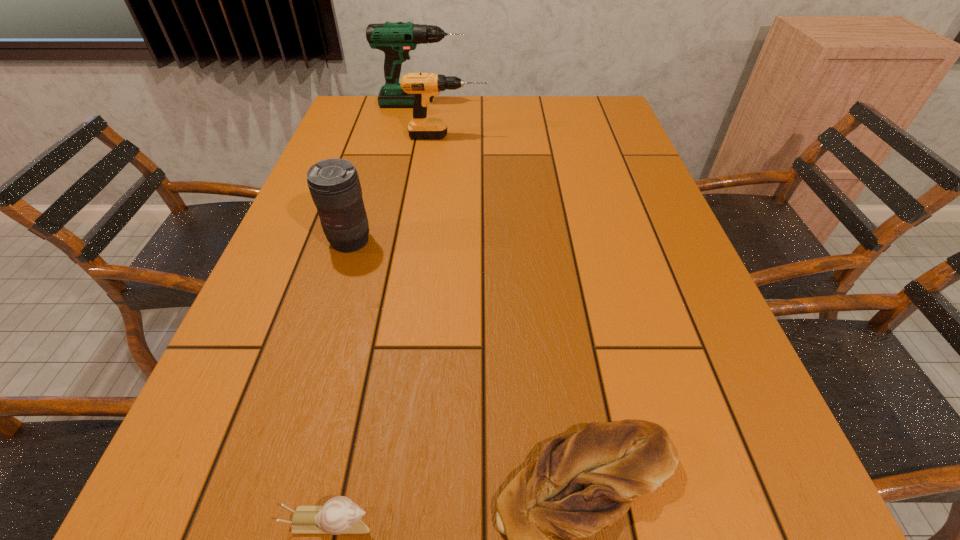
Find the location of a particular element. The width and height of the screenshot is (960, 540). telephoto lens present at the left edge is located at coordinates (334, 184).

Find the location of a particular element. object present at the far left corner is located at coordinates (396, 40).

This screenshot has width=960, height=540. I want to click on free spot at the far edge of the desktop, so click(x=549, y=126).

Locate an element on the screen. The width and height of the screenshot is (960, 540). vacant space at the near edge is located at coordinates (482, 521).

Identify the location of vacant space at the left edge of the desktop. The width and height of the screenshot is (960, 540). (231, 376).

Find the location of `vacant area at the right edge of the desktop`. vacant area at the right edge of the desktop is located at coordinates (599, 141).

Identify the location of free space at the far left corner of the desktop. (364, 118).

You are a GUI agent. You are given a task and a screenshot of the screen. Output one action in this format:
    pyautogui.click(x=<x>, y=<y>)
    Task: Click on the free spot between the tallest object and the telephoto lens
    The width and height of the screenshot is (960, 540).
    Given the screenshot: What is the action you would take?
    pyautogui.click(x=386, y=173)

Select which object is the fourth closest to the escargot. Please provide its 2D coordinates. Your answer should be formatted as a tuple, i.e. [(x, y)], where the tuple contains the x and y coordinates of a point satisfying the conditions above.

[(396, 40)]

I want to click on object that is the second closest to the tallest object, so click(x=334, y=184).